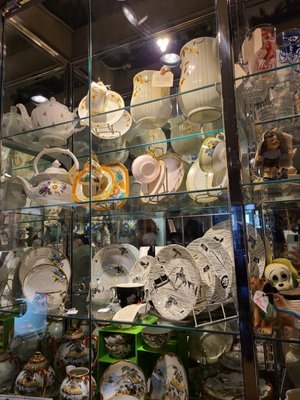
At what (x,y) coordinates should I click in order to perform the action: click on teapots. Please return your answer as a coordinate pair (x, y). The height and width of the screenshot is (400, 300). Looking at the image, I should click on [53, 113], [50, 188].